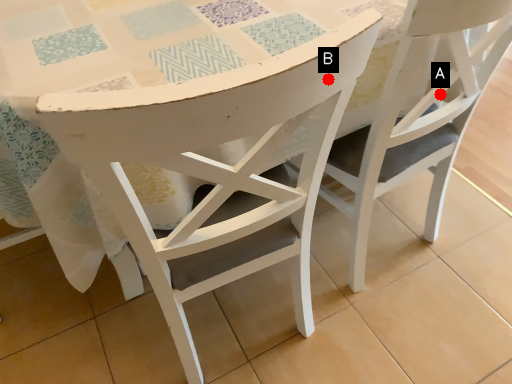
Question: Two points are circled on the image, labeled by A and B beside each circle. Which point is further to the camera?

Choices:
 (A) A is further
 (B) B is further

Answer: (A)